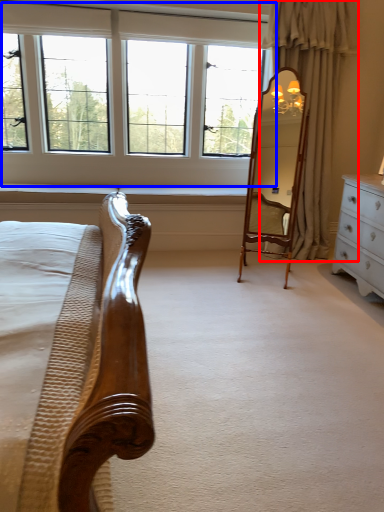
Question: Among these objects, which one is farthest to the camera, curtain (highlighted by a red box) or window (highlighted by a blue box)?

Choices:
 (A) curtain
 (B) window

Answer: (B)